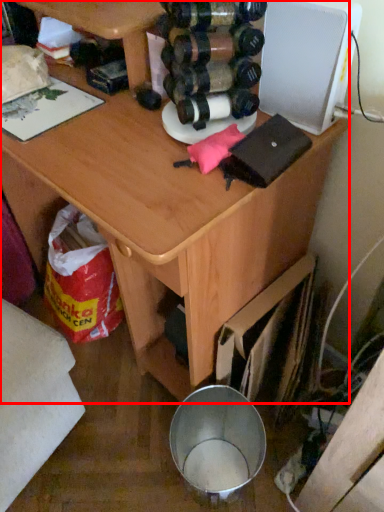
Question: Where is desk (annotated by the red box) located in relation to appliance in the image?

Choices:
 (A) left
 (B) right

Answer: (A)